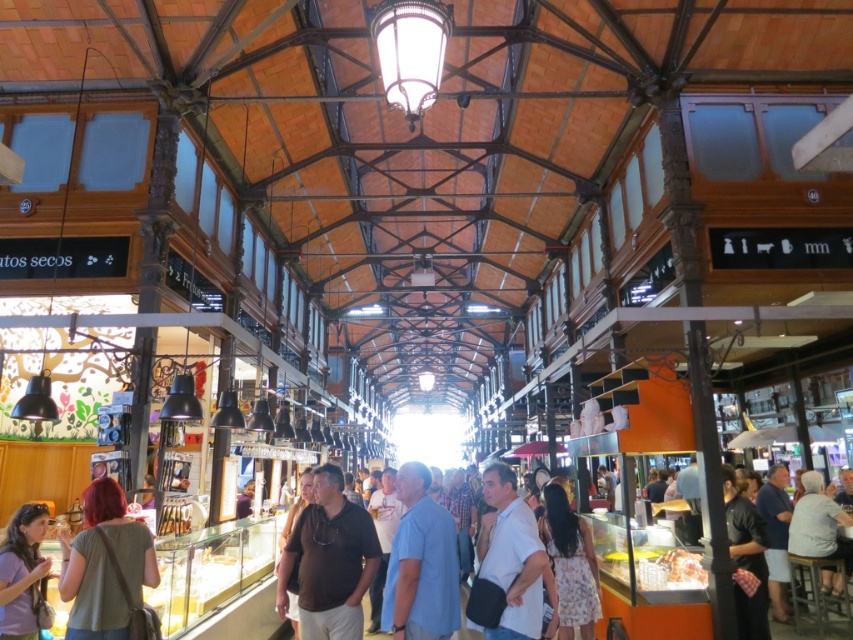
Based on the photo, does matte green shirt at lower left appear under white cotton shirt at lower right?

Actually, matte green shirt at lower left is above white cotton shirt at lower right.

Which is more to the left, matte green shirt at lower left or white cotton shirt at lower right?

Positioned to the left is matte green shirt at lower left.

Where is `matte green shirt at lower left`? matte green shirt at lower left is located at coordinates (22, 572).

This screenshot has width=853, height=640. Describe the element at coordinates (421, 564) in the screenshot. I see `blue cotton shirt at center` at that location.

At what (x,y) coordinates should I click in order to perform the action: click on blue cotton shirt at center. Please return your answer as a coordinate pair (x, y). Looking at the image, I should click on tap(421, 564).

Find the location of a particular element. blue cotton shirt at center is located at coordinates (421, 564).

Does brown matte shirt at center have a larger size compared to matte green shirt at lower left?

Indeed, brown matte shirt at center has a larger size compared to matte green shirt at lower left.

Is point (321, 579) farther from camera compared to point (7, 611)?

That is True.

Does point (337, 564) come farther from viewer compared to point (21, 584)?

Yes, point (337, 564) is behind point (21, 584).

Image resolution: width=853 pixels, height=640 pixels. I want to click on brown matte shirt at center, so click(x=329, y=561).